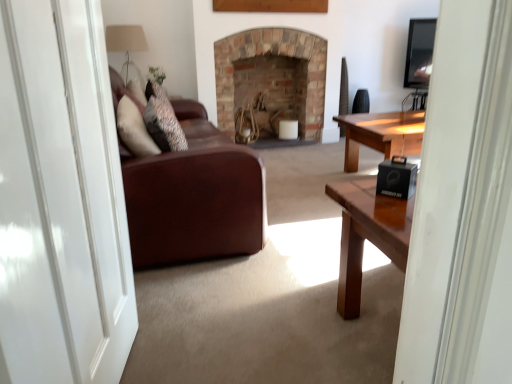
This screenshot has width=512, height=384. Identify the location of vacant space in front of black matte speaker at lower right. (387, 215).